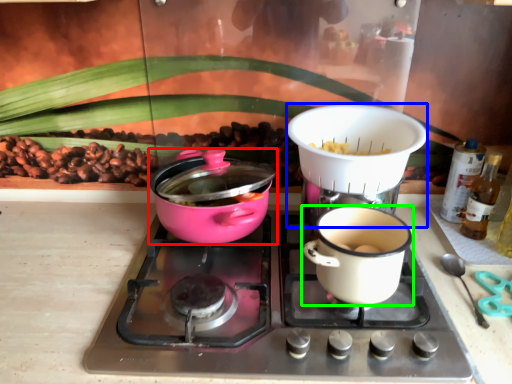
Question: Estimate the real-world distances between objects in this image. Which object is farther from kitchen appliance (highlighted by a red box), appliance (highlighted by a blue box) or coffee cup (highlighted by a green box)?

Choices:
 (A) appliance
 (B) coffee cup

Answer: (B)